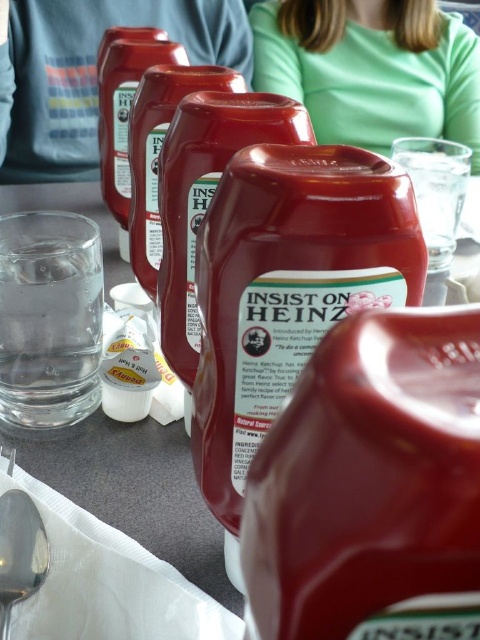
Question: Is matte plastic cup at upper center to the right of green matte shirt at upper center from the viewer's perspective?

Choices:
 (A) no
 (B) yes

Answer: (A)

Question: Which object is farther from the camera taking this photo?

Choices:
 (A) satin silver spoon at lower left
 (B) green matte shirt at upper center
 (C) matte plastic cup at upper center

Answer: (B)

Question: In this image, where is matte plastic cup at upper center located relative to green matte shirt at upper center?

Choices:
 (A) above
 (B) below

Answer: (B)

Question: Which point appears farthest from the camera in this image?

Choices:
 (A) (24, 541)
 (B) (51, 173)

Answer: (B)

Question: Among these points, which one is farthest from the camera?

Choices:
 (A) (443, 51)
 (B) (0, 40)

Answer: (A)

Question: Considering the relative positions of green matte shirt at upper center and satin silver spoon at lower left in the image provided, where is green matte shirt at upper center located with respect to satin silver spoon at lower left?

Choices:
 (A) left
 (B) right

Answer: (B)